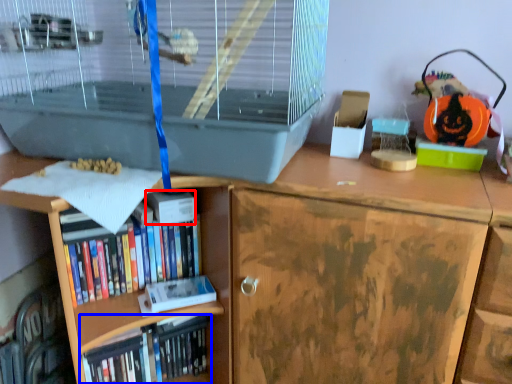
Question: Which object is closer to the camera taking this photo, paperback book (highlighted by a red box) or book (highlighted by a blue box)?

Choices:
 (A) paperback book
 (B) book

Answer: (A)